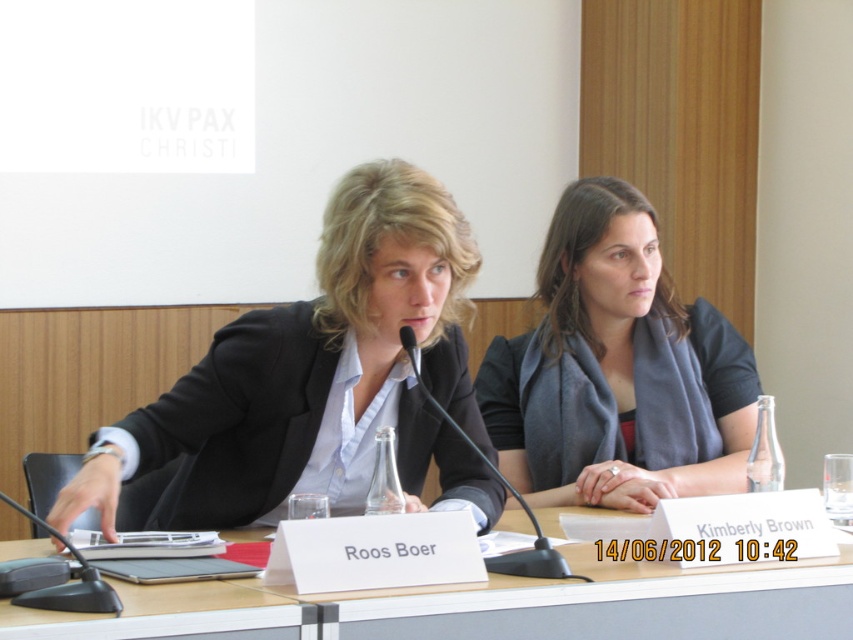
You are sitting at the conference table and need to reach both the point at coordinates point (296, 426) and the point at coordinates point (28, 605). Which point should you reach for first to minimize the distance traveled?

You should reach for point (28, 605) first since it is closer to you than point (296, 426), which is behind it.

You are organizing a small event and need to place a 15 cm wide decorative item on the table between the matte black blazer at center and the black plastic microphone at lower left. Based on their sizes, will the item fit between them?

The matte black blazer at center is wider than the black plastic microphone at lower left. Since the decorative item is 15 cm wide, it might fit between them if there is enough space, but the exact placement depends on the distance between the two objects.

You are a photographer trying to capture a closeup shot of the matte gray scarf at center and the black plastic microphone at lower left. Which object should you focus on first to ensure it appears sharp in the photo?

The matte gray scarf at center is further to the viewer than the black plastic microphone at lower left, so you should focus on the matte gray scarf at center first to ensure it appears sharp in the photo.